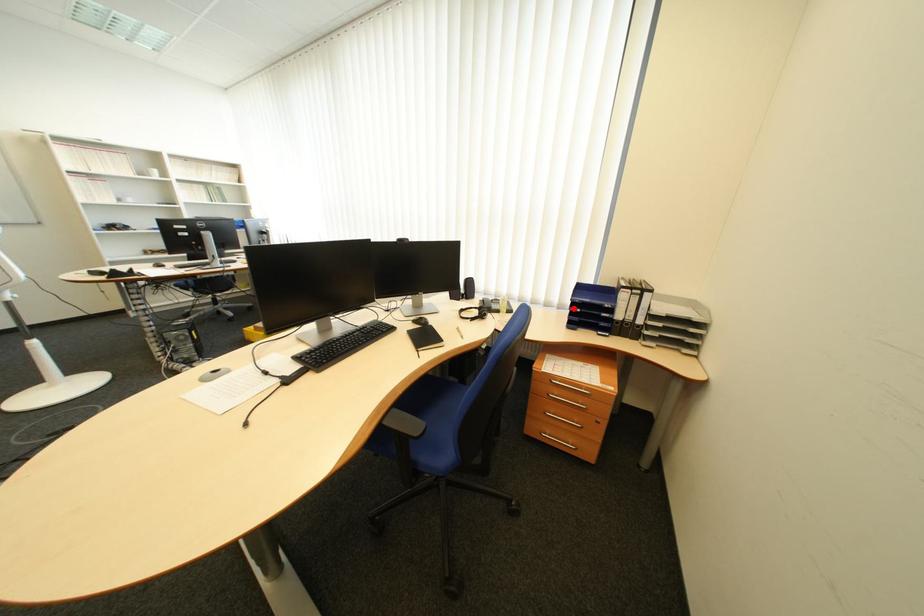
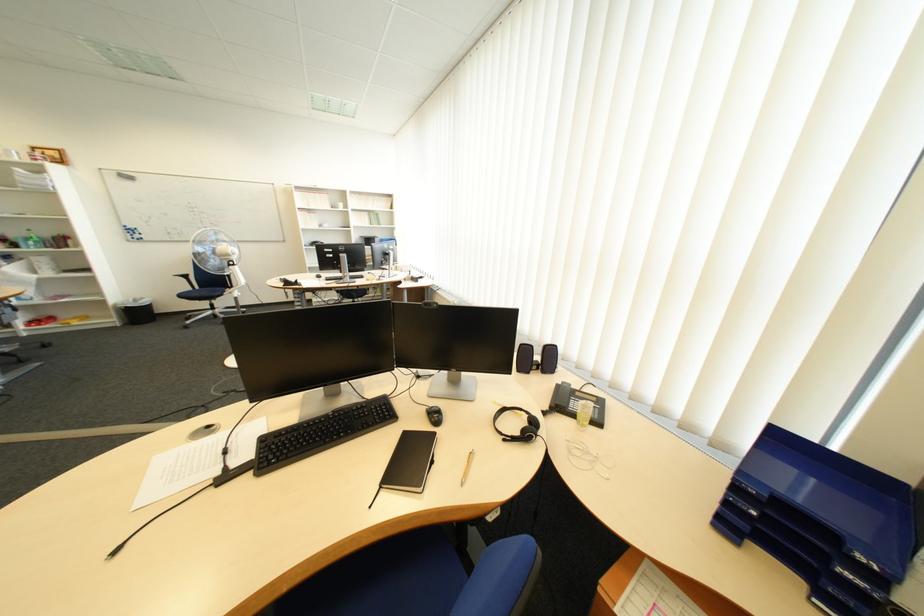
Find the pixel in the second image that matches the highlighted location in the first image.

(730, 446)